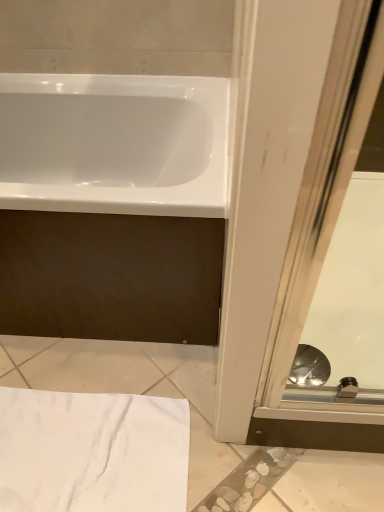
Question: Is transparent glass screen door at lower right at the back of white cotton towel at lower left?

Choices:
 (A) no
 (B) yes

Answer: (A)

Question: Is white cotton towel at lower left smaller than transparent glass screen door at lower right?

Choices:
 (A) yes
 (B) no

Answer: (A)

Question: Is white cotton towel at lower left far away from transparent glass screen door at lower right?

Choices:
 (A) no
 (B) yes

Answer: (A)

Question: Is white cotton towel at lower left positioned beyond the bounds of transparent glass screen door at lower right?

Choices:
 (A) no
 (B) yes

Answer: (B)

Question: From the image's perspective, is white cotton towel at lower left located beneath transparent glass screen door at lower right?

Choices:
 (A) yes
 (B) no

Answer: (A)

Question: Is white cotton towel at lower left taller or shorter than transparent glass screen door at lower right?

Choices:
 (A) tall
 (B) short

Answer: (B)

Question: From a real-world perspective, is white cotton towel at lower left above or below transparent glass screen door at lower right?

Choices:
 (A) below
 (B) above

Answer: (A)

Question: Relative to transparent glass screen door at lower right, is white cotton towel at lower left in front or behind?

Choices:
 (A) behind
 (B) front

Answer: (A)

Question: In the image, is white cotton towel at lower left on the left side or the right side of transparent glass screen door at lower right?

Choices:
 (A) left
 (B) right

Answer: (A)

Question: Is transparent glass screen door at lower right inside or outside of white glossy bathtub at upper left?

Choices:
 (A) inside
 (B) outside

Answer: (B)

Question: In the image, is transparent glass screen door at lower right on the left side or the right side of white glossy bathtub at upper left?

Choices:
 (A) left
 (B) right

Answer: (B)

Question: Is point (326, 196) closer or farther from the camera than point (183, 189)?

Choices:
 (A) farther
 (B) closer

Answer: (B)

Question: In terms of width, does transparent glass screen door at lower right look wider or thinner when compared to white glossy bathtub at upper left?

Choices:
 (A) thin
 (B) wide

Answer: (B)

Question: Visually, is white glossy bathtub at upper left positioned to the left or to the right of white cotton towel at lower left?

Choices:
 (A) right
 (B) left

Answer: (B)

Question: Is white glossy bathtub at upper left situated inside white cotton towel at lower left or outside?

Choices:
 (A) outside
 (B) inside

Answer: (A)